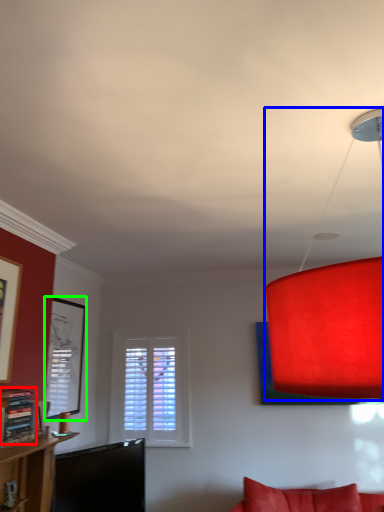
Question: Which object is the farthest from shelf (highlighted by a red box)? Choose among these: lamp (highlighted by a blue box) or picture frame (highlighted by a green box).

Choices:
 (A) lamp
 (B) picture frame

Answer: (A)